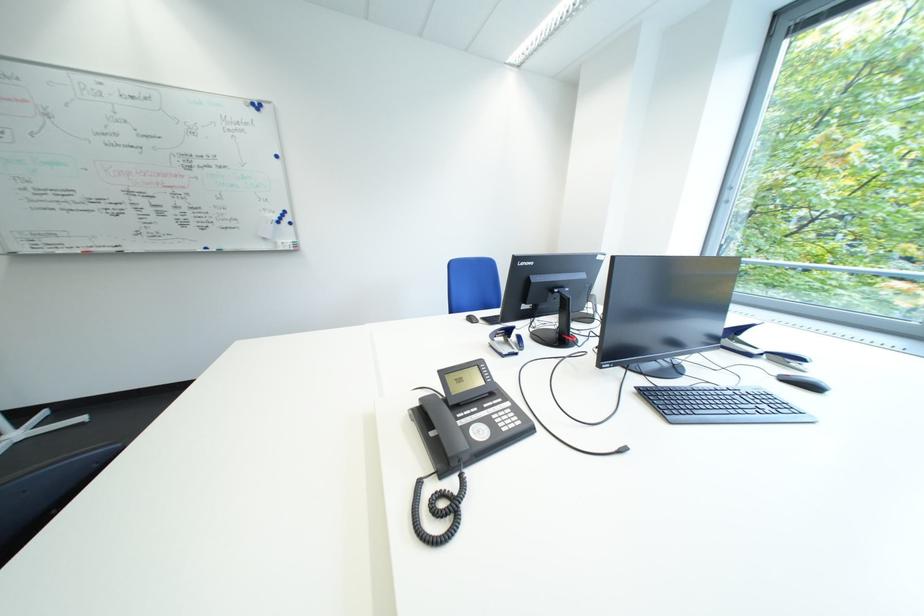
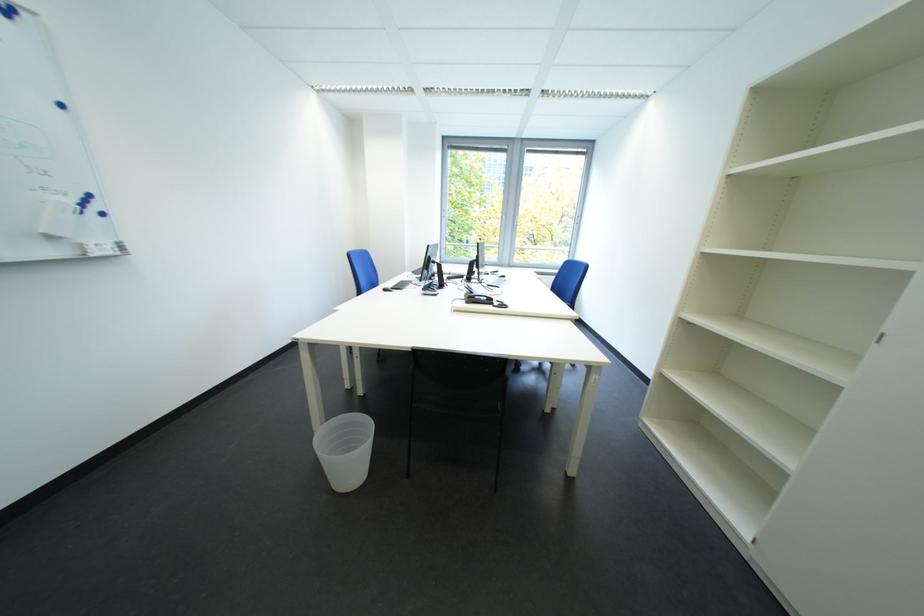
Locate, in the second image, the point that corresponds to (270,108) in the first image.

(17, 12)